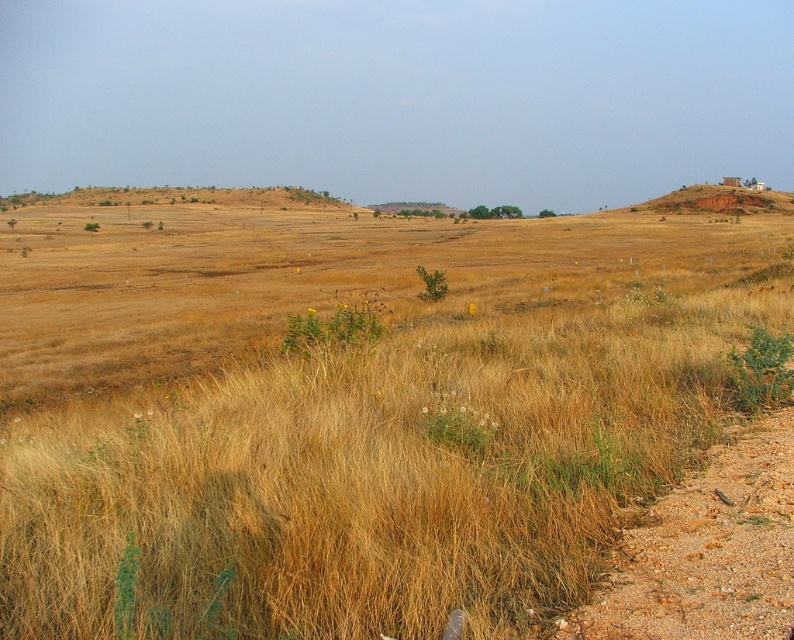
Based on the photo, you are standing at the origin point of the coordinate system in the image. You want to walk to the brown grassy field at center. What direction should you move in to reach it?

The brown grassy field at center is located at coordinate point 0.644 on the x axis and 0.442 on the y axis, so you should move northeast to reach it.

You are standing at the point marked as point (x=349, y=412) in the image. What do you see directly beneath your feet?

You see the brown grassy field at center directly beneath your feet at point (x=349, y=412).